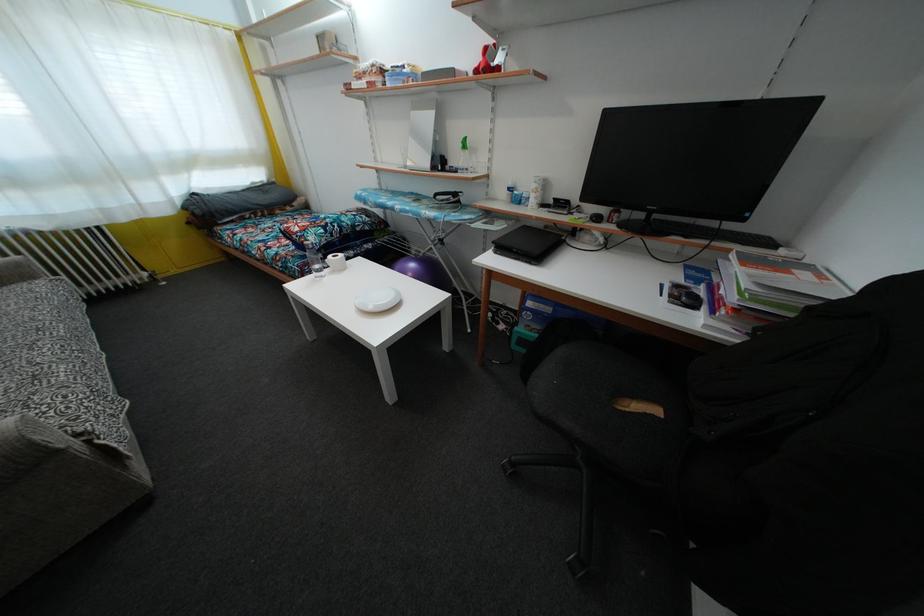
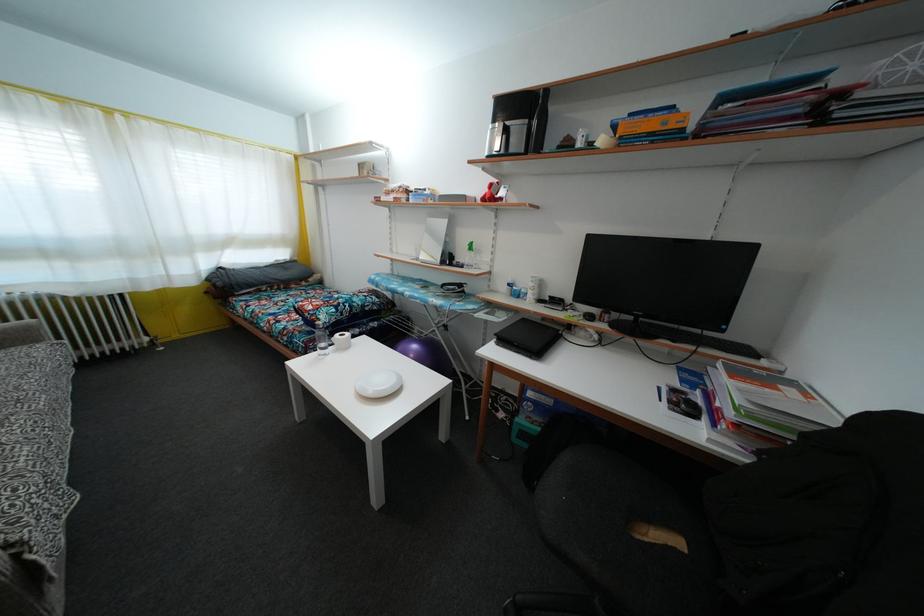
Question: How did the camera likely rotate?

Choices:
 (A) Left
 (B) Right
 (C) Up
 (D) Down

Answer: (C)